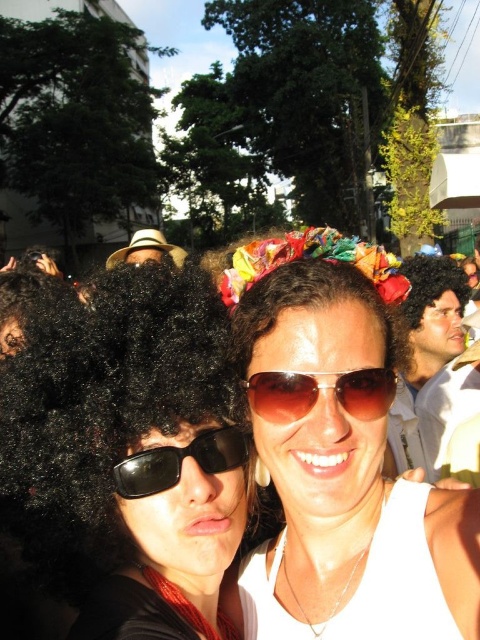
You are standing in the center of the scene and want to find the matte white shirt at center. According to the coordinates provided, in which direction should you look to locate it?

The matte white shirt at center is located at coordinates point (422, 348), which means it is slightly to the right and above the center point of the scene. So you should look slightly to the right and upwards from the center to find it.

You are a photographer holding a camera and want to capture a closeup shot of the brown reflective sunglasses at center. The camera lens has a minimum focusing distance of 5 feet. Can you take the photo without moving closer?

The brown reflective sunglasses at center is 4.85 feet away from the camera. Since the minimum focusing distance is 5 feet, the camera cannot focus at that distance. You need to move back or use a different lens with a shorter minimum focusing distance.